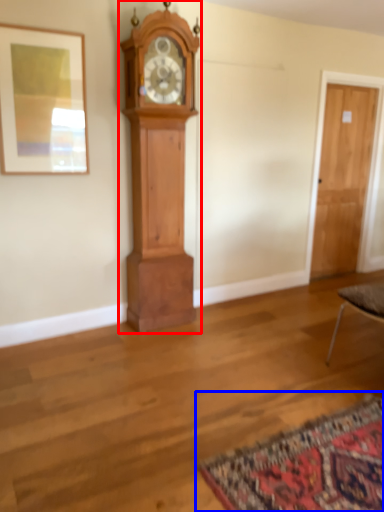
Question: Which object appears closest to the camera in this image, wall clock (highlighted by a red box) or mat (highlighted by a blue box)?

Choices:
 (A) wall clock
 (B) mat

Answer: (B)